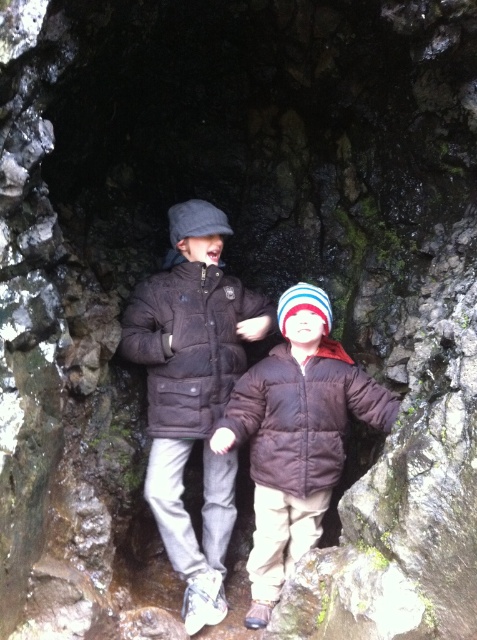
Does matte black jacket at center appear under brown puffy coat at center?

No, matte black jacket at center is not below brown puffy coat at center.

Is point (173, 461) positioned behind point (284, 317)?

No, it is in front of (284, 317).

This screenshot has width=477, height=640. I want to click on matte black jacket at center, so click(193, 392).